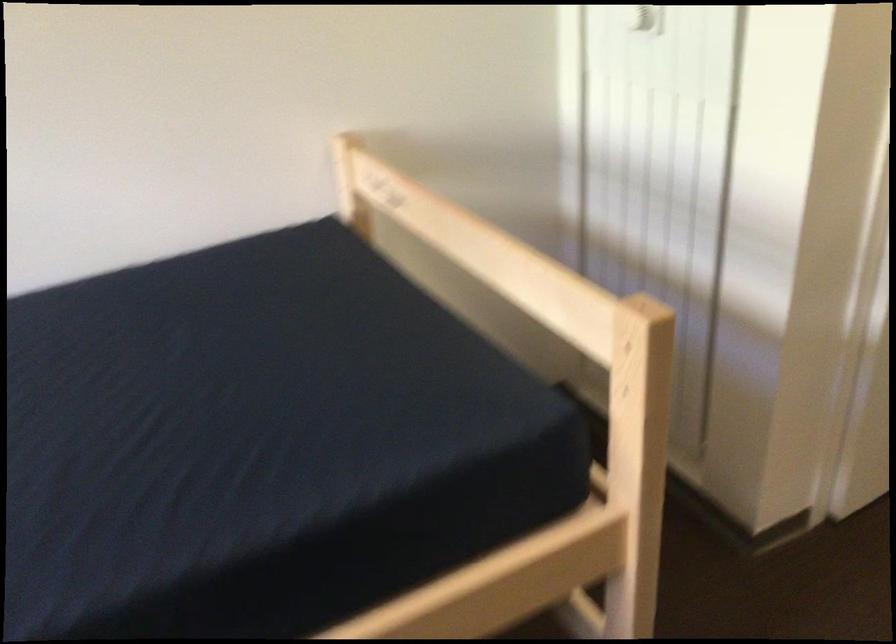
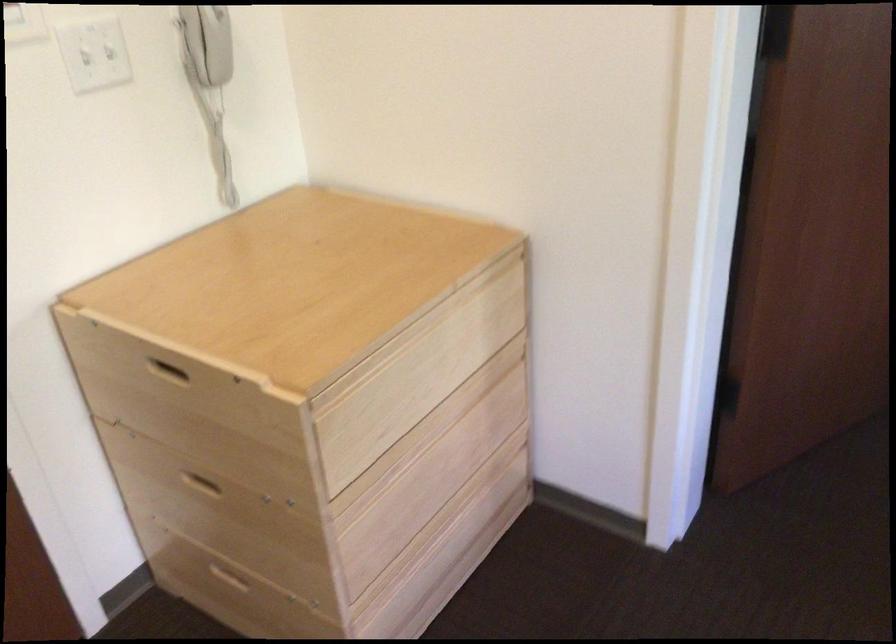
The first image is from the beginning of the video and the second image is from the end. How did the camera likely rotate when shooting the video?

The camera rotated toward right-down.